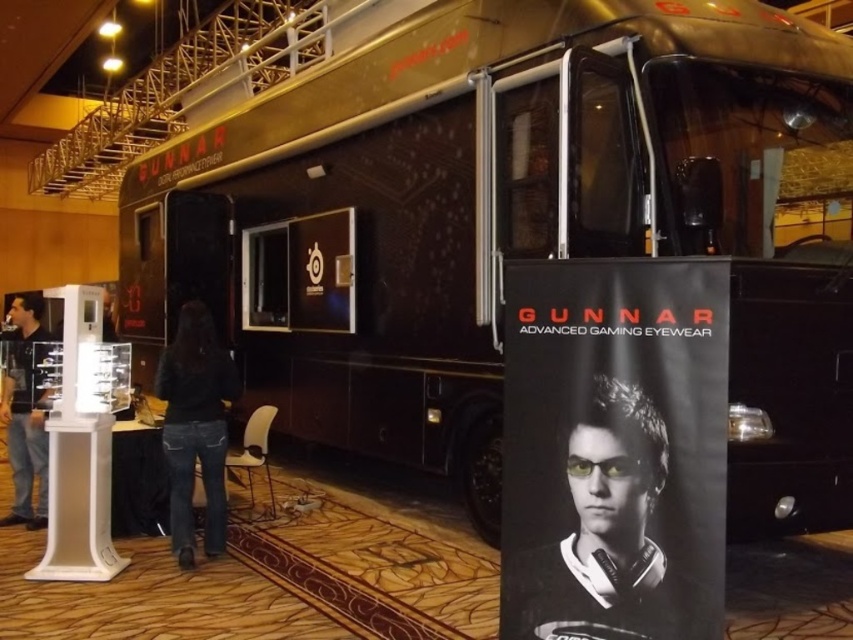
Is metallic gold bus at center behind dark blue jeans at left?

No, it is not.

Is metallic gold bus at center bigger than dark blue jeans at left?

Incorrect, metallic gold bus at center is not larger than dark blue jeans at left.

The image size is (853, 640). In order to click on metallic gold bus at center in this screenshot , I will do `click(515, 225)`.

Does matte black poster at center have a smaller size compared to dark blue jeans at left?

Yes, matte black poster at center is smaller than dark blue jeans at left.

Who is taller, matte black poster at center or dark blue jeans at left?

With more height is dark blue jeans at left.

Identify the location of matte black poster at center. The width and height of the screenshot is (853, 640). (604, 525).

Can you confirm if matte black poster at center is shorter than dark blue jeans at lower center?

Correct, matte black poster at center is not as tall as dark blue jeans at lower center.

Is matte black poster at center wider than dark blue jeans at lower center?

Correct, the width of matte black poster at center exceeds that of dark blue jeans at lower center.

At what (x,y) coordinates should I click in order to perform the action: click on matte black poster at center. Please return your answer as a coordinate pair (x, y). The height and width of the screenshot is (640, 853). Looking at the image, I should click on (604, 525).

Locate an element on the screen. matte black poster at center is located at coordinates (604, 525).